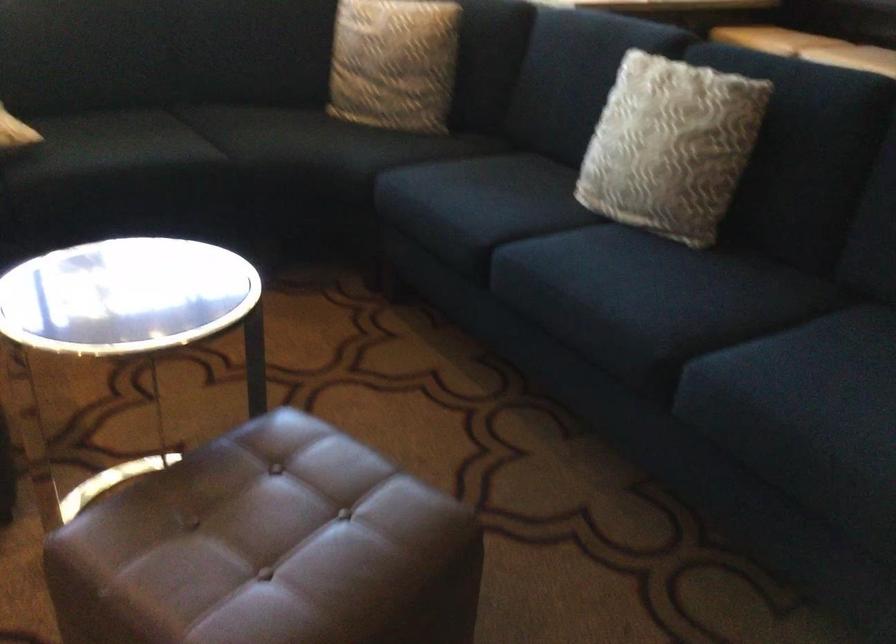
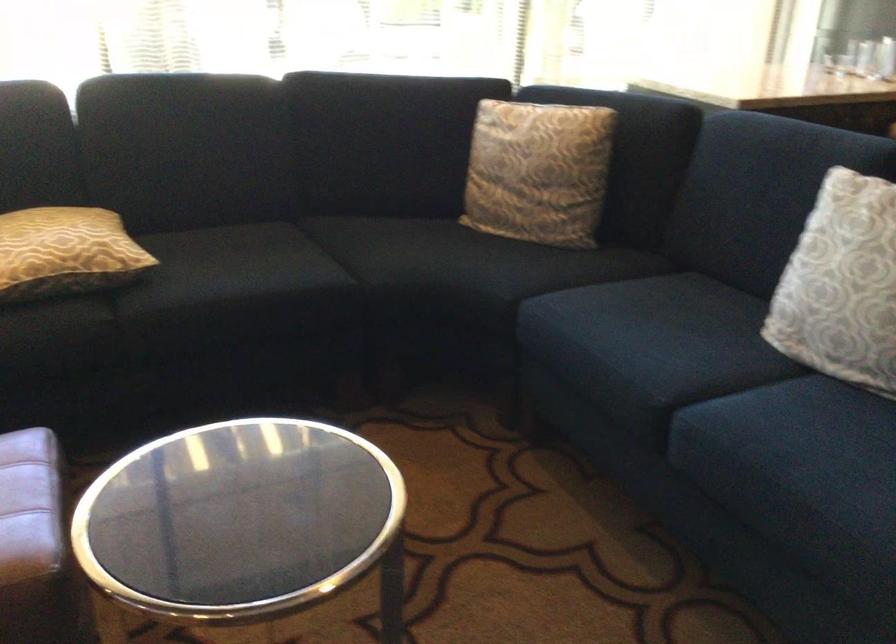
Question: The images are taken continuously from a first-person perspective. In which direction are you moving?

Choices:
 (A) Left
 (B) Right
 (C) Forward
 (D) Backward

Answer: (C)